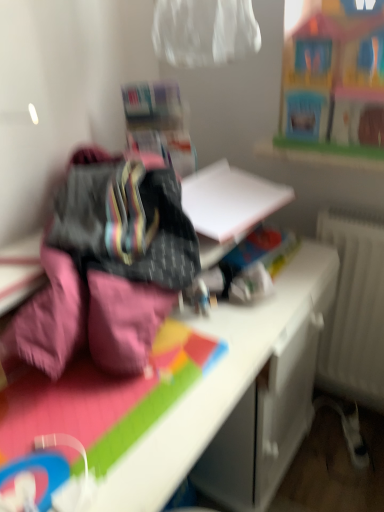
Question: Would you say pink fabric at left is part of wooden toy house at upper right's contents?

Choices:
 (A) yes
 (B) no

Answer: (B)

Question: Considering the relative sizes of wooden toy house at upper right and pink fabric at left in the image provided, is wooden toy house at upper right taller than pink fabric at left?

Choices:
 (A) yes
 (B) no

Answer: (B)

Question: Could you tell me if wooden toy house at upper right is facing pink fabric at left?

Choices:
 (A) no
 (B) yes

Answer: (B)

Question: Is wooden toy house at upper right completely or partially outside of pink fabric at left?

Choices:
 (A) no
 (B) yes

Answer: (B)

Question: Considering the relative sizes of wooden toy house at upper right and pink fabric at left in the image provided, is wooden toy house at upper right thinner than pink fabric at left?

Choices:
 (A) yes
 (B) no

Answer: (A)

Question: Considering the relative sizes of wooden toy house at upper right and pink fabric at left in the image provided, is wooden toy house at upper right shorter than pink fabric at left?

Choices:
 (A) yes
 (B) no

Answer: (A)

Question: From a real-world perspective, is white glossy desk at center on top of pink fabric at left?

Choices:
 (A) yes
 (B) no

Answer: (B)

Question: From a real-world perspective, is white glossy desk at center below pink fabric at left?

Choices:
 (A) yes
 (B) no

Answer: (A)

Question: Considering the relative sizes of white glossy desk at center and pink fabric at left in the image provided, is white glossy desk at center shorter than pink fabric at left?

Choices:
 (A) no
 (B) yes

Answer: (A)

Question: Is white glossy desk at center placed right next to pink fabric at left?

Choices:
 (A) yes
 (B) no

Answer: (B)

Question: Is the depth of white glossy desk at center less than that of pink fabric at left?

Choices:
 (A) no
 (B) yes

Answer: (B)

Question: Would you consider white glossy desk at center to be distant from pink fabric at left?

Choices:
 (A) no
 (B) yes

Answer: (A)

Question: Considering the relative sizes of pink fabric at left and wooden toy house at upper right in the image provided, is pink fabric at left thinner than wooden toy house at upper right?

Choices:
 (A) no
 (B) yes

Answer: (A)